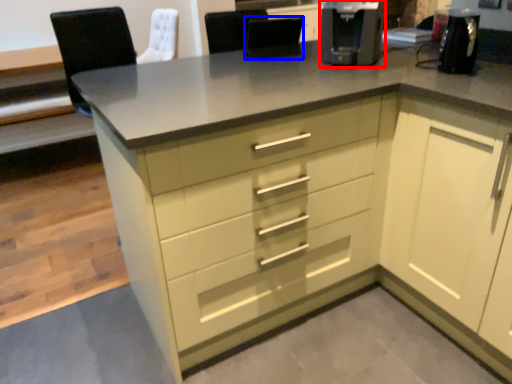
Question: Which object appears closest to the camera in this image, coffee machine (highlighted by a red box) or chair (highlighted by a blue box)?

Choices:
 (A) coffee machine
 (B) chair

Answer: (A)